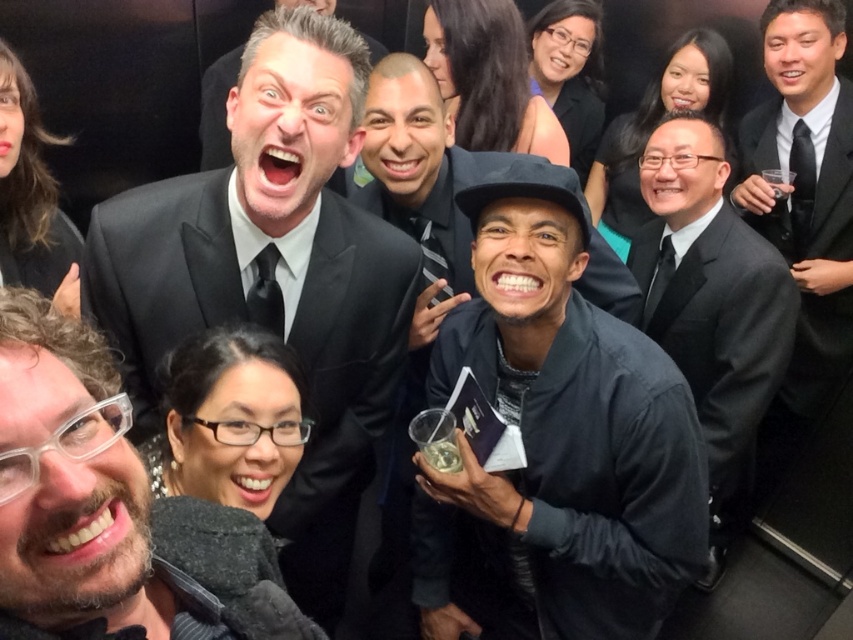
Based on the photo, you are a photographer at a formal event. You want to capture a photo that includes both the matte black suit at upper center and the black matte hat at center. What is the minimum distance you need to set between the camera and the subjects to ensure both are in frame?

The minimum distance required is 16.34 inches, as the matte black suit at upper center and the black matte hat at center are positioned 16.34 inches apart.

You are a photographer at a formal event and need to capture a photo of the matte black suit at upper center and the black matte hat at center. Which object should you focus on first if you want to ensure both are in focus without adjusting the camera settings?

The matte black suit at upper center is much taller than the black matte hat at center, so focusing on the matte black suit at upper center first would ensure both are in focus since it is farther away and requires a smaller aperture or greater depth of field.

You are a photographer at this event. You want to capture a photo that includes both the dark blue fabric jacket at center and the black suit at center. The camera you are using has a maximum focus range of 30 inches. Can you fit both subjects in the frame without moving the camera?

The distance between the dark blue fabric jacket at center and the black suit at center is 33.00 inches, which exceeds the camera maximum focus range of 30 inches. Therefore, you cannot fit both subjects in the frame without moving the camera.